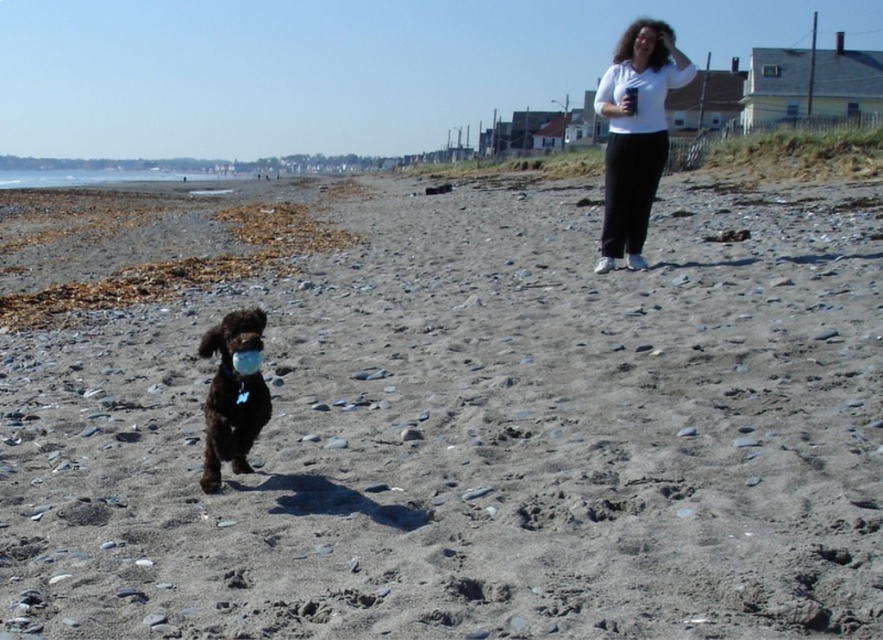
Can you confirm if gray gravelly sand at center is positioned to the right of shiny brown dog at center?

Indeed, gray gravelly sand at center is positioned on the right side of shiny brown dog at center.

Can you confirm if gray gravelly sand at center is shorter than shiny brown dog at center?

No.

At what (x,y) coordinates should I click in order to perform the action: click on gray gravelly sand at center. Please return your answer as a coordinate pair (x, y). This screenshot has width=883, height=640. Looking at the image, I should click on point(476,435).

In the scene shown: Which is more to the left, shiny brown dog at center or matte white mouth at upper center?

shiny brown dog at center

The height and width of the screenshot is (640, 883). What are the coordinates of `shiny brown dog at center` in the screenshot? It's located at (232, 396).

Is point (476, 428) positioned before point (636, 45)?

Yes, it is in front of point (636, 45).

Who is higher up, gray gravelly sand at center or matte white mouth at upper center?

matte white mouth at upper center is higher up.

Where is `gray gravelly sand at center`? This screenshot has height=640, width=883. gray gravelly sand at center is located at coordinates (476, 435).

Where is `gray gravelly sand at center`? The image size is (883, 640). gray gravelly sand at center is located at coordinates (476, 435).